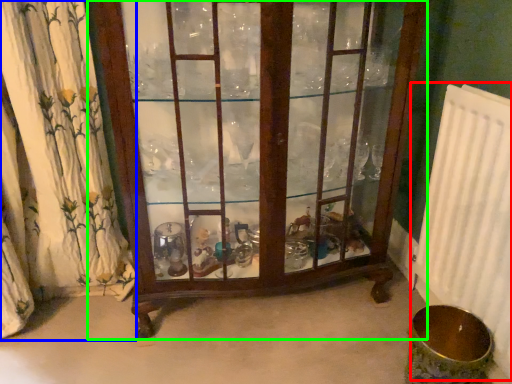
Question: Which object is the farthest from radiator (highlighted by a red box)? Choose among these: curtain (highlighted by a blue box) or furniture (highlighted by a green box).

Choices:
 (A) curtain
 (B) furniture

Answer: (A)